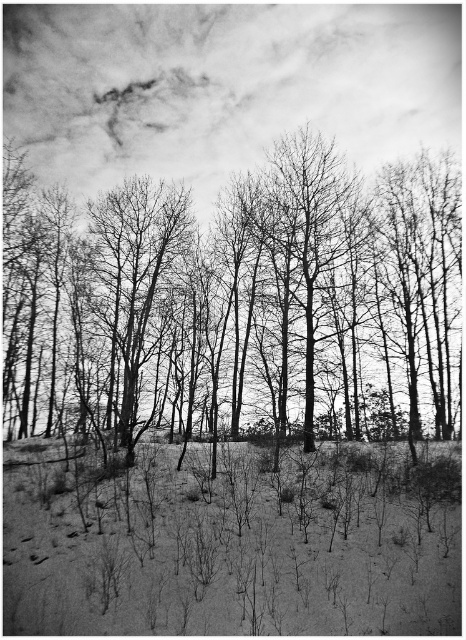
You are standing in the winter landscape and want to take a photo of the smooth bark trees at center and the smooth bark tree at center. Which one should you focus on first to ensure both are in sharp focus?

You should focus on the smooth bark tree at center first because it is closer to the viewer, ensuring that both it and the farther smooth bark trees at center will be in focus when using proper depth of field.

In the winter landscape scene, there are two trees labeled as smooth bark trees at center and smooth bark tree at center. Which of these two trees has a greater width?

The smooth bark trees at center has a greater width than the smooth bark tree at center.

Looking at the winter landscape, there are two objects of interest in the scene. One is the smooth bark trees at center and the other is the smooth bark tree at center. Which of these two objects is positioned higher in the image?

The smooth bark trees at center is positioned higher than the smooth bark tree at center in the image.